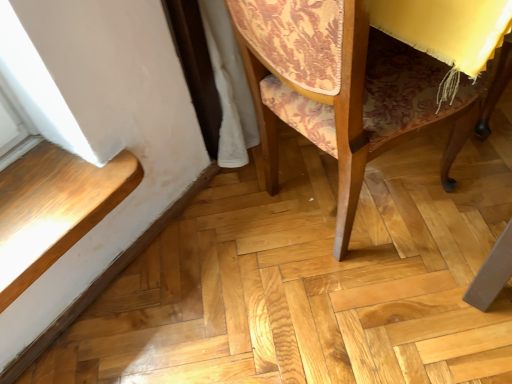
Find the location of a particular element. vacant space that is in between patterned fabric chair at center and wooden floor at lower left is located at coordinates (184, 276).